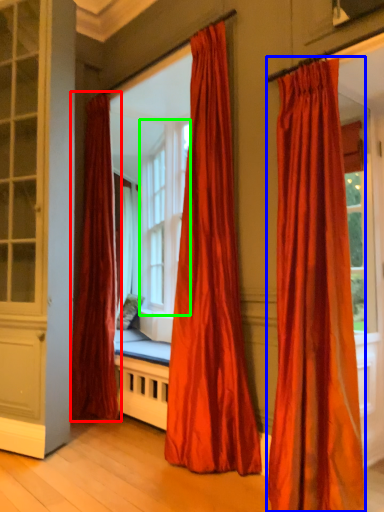
Question: Which object is positioned farthest from curtain (highlighted by a red box)? Select from curtain (highlighted by a blue box) and bay window (highlighted by a green box).

Choices:
 (A) curtain
 (B) bay window

Answer: (A)